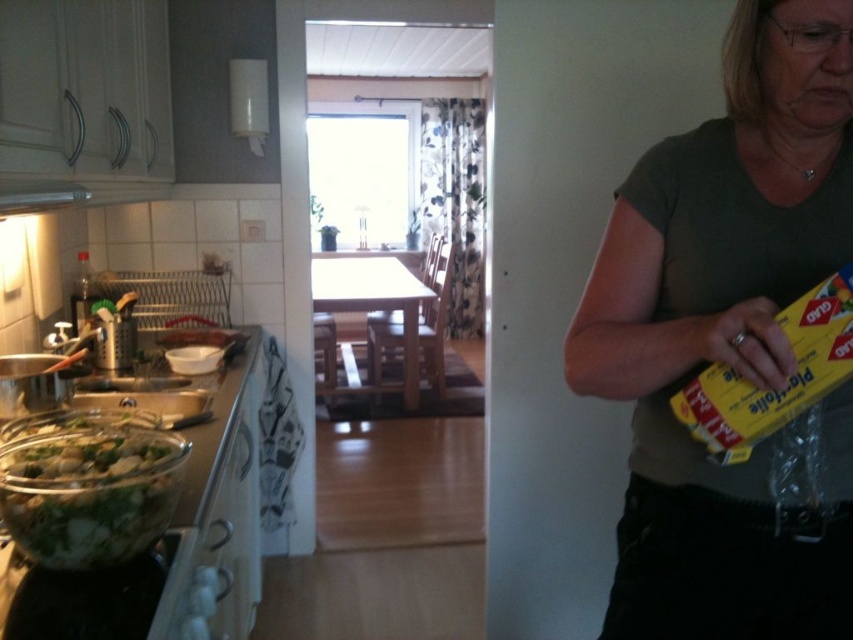
Does green leafy vegetables at lower left lie behind metallic silver exhaust hood at upper left?

Yes, green leafy vegetables at lower left is behind metallic silver exhaust hood at upper left.

Can you confirm if green leafy vegetables at lower left is smaller than metallic silver exhaust hood at upper left?

Yes, green leafy vegetables at lower left is smaller than metallic silver exhaust hood at upper left.

Locate an element on the screen. This screenshot has height=640, width=853. green leafy vegetables at lower left is located at coordinates (90, 493).

Can you confirm if gray matte t-shirt at upper right is taller than metallic silver exhaust hood at upper left?

Yes.

Is point (657, 476) farther from camera compared to point (135, 198)?

No, it is in front of (135, 198).

What are the coordinates of `gray matte t-shirt at upper right` in the screenshot? It's located at (728, 339).

Can you confirm if gray matte t-shirt at upper right is taller than green leafy vegetables at lower left?

Yes, gray matte t-shirt at upper right is taller than green leafy vegetables at lower left.

Between point (822, 156) and point (26, 515), which one is positioned in front?

Point (26, 515) is more forward.

Does point (703, 365) come closer to viewer compared to point (161, 433)?

Yes, point (703, 365) is in front of point (161, 433).

At what (x,y) coordinates should I click in order to perform the action: click on gray matte t-shirt at upper right. Please return your answer as a coordinate pair (x, y). Looking at the image, I should click on (728, 339).